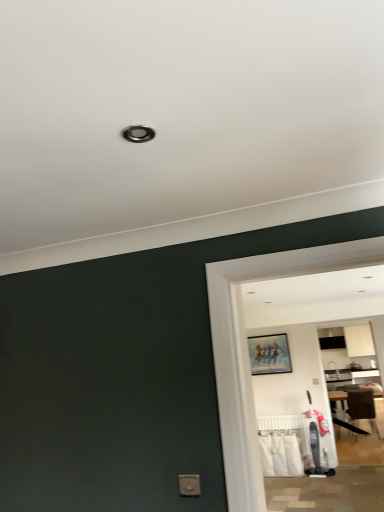
Question: From the image's perspective, would you say matte wooden picture frame at center is positioned over white plastic radiator at lower center?

Choices:
 (A) yes
 (B) no

Answer: (A)

Question: Can you confirm if matte wooden picture frame at center is taller than white plastic radiator at lower center?

Choices:
 (A) yes
 (B) no

Answer: (A)

Question: From a real-world perspective, is matte wooden picture frame at center on top of white plastic radiator at lower center?

Choices:
 (A) no
 (B) yes

Answer: (B)

Question: Is matte wooden picture frame at center looking in the opposite direction of white plastic radiator at lower center?

Choices:
 (A) yes
 (B) no

Answer: (B)

Question: From a real-world perspective, is matte wooden picture frame at center positioned under white plastic radiator at lower center based on gravity?

Choices:
 (A) no
 (B) yes

Answer: (A)

Question: Relative to brown fabric chair at right, is matte wooden picture frame at center in front or behind?

Choices:
 (A) front
 (B) behind

Answer: (A)

Question: Is point (251, 339) closer or farther from the camera than point (370, 418)?

Choices:
 (A) closer
 (B) farther

Answer: (A)

Question: From their relative heights in the image, would you say matte wooden picture frame at center is taller or shorter than brown fabric chair at right?

Choices:
 (A) short
 (B) tall

Answer: (A)

Question: From the image's perspective, is matte wooden picture frame at center positioned above or below brown fabric chair at right?

Choices:
 (A) above
 (B) below

Answer: (A)

Question: Is point (364, 409) positioned closer to the camera than point (302, 416)?

Choices:
 (A) closer
 (B) farther

Answer: (B)

Question: Is brown fabric chair at right taller or shorter than white plastic radiator at lower center?

Choices:
 (A) tall
 (B) short

Answer: (A)

Question: In the image, is brown fabric chair at right positioned in front of or behind white plastic radiator at lower center?

Choices:
 (A) behind
 (B) front

Answer: (A)

Question: Do you think brown fabric chair at right is within white plastic radiator at lower center, or outside of it?

Choices:
 (A) outside
 (B) inside

Answer: (A)

Question: From their relative heights in the image, would you say white plastic radiator at lower center is taller or shorter than brown fabric chair at right?

Choices:
 (A) short
 (B) tall

Answer: (A)

Question: Considering the positions of point (301, 446) and point (357, 415), is point (301, 446) closer or farther from the camera than point (357, 415)?

Choices:
 (A) closer
 (B) farther

Answer: (A)